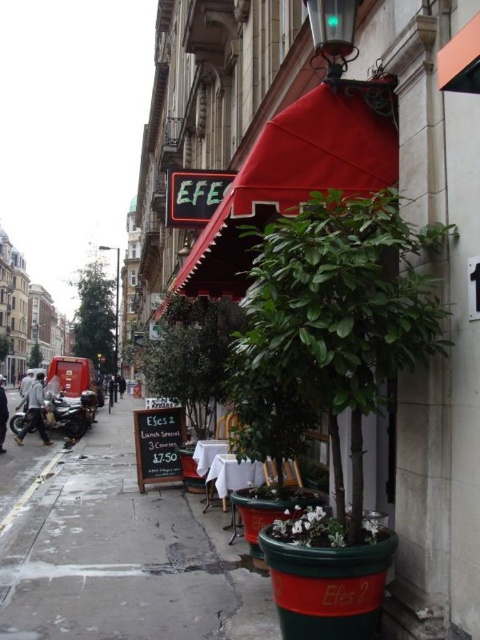
Question: Which point is farther to the camera?

Choices:
 (A) green leafy plant at center
 (B) green matte plant at center

Answer: (B)

Question: Is shiny black motorcycle at left below dark blue jacket at left?

Choices:
 (A) yes
 (B) no

Answer: (B)

Question: Which object appears farthest from the camera in this image?

Choices:
 (A) dark gray jacket at center
 (B) green matte plant at center

Answer: (A)

Question: Which point is closer to the camera?

Choices:
 (A) (72, 419)
 (B) (112, 388)

Answer: (A)

Question: Can you confirm if green leafy plant at center is positioned to the right of shiny black motorcycle at left?

Choices:
 (A) no
 (B) yes

Answer: (B)

Question: Can you confirm if matte red awning at upper center is thinner than dark gray jacket at center?

Choices:
 (A) yes
 (B) no

Answer: (B)